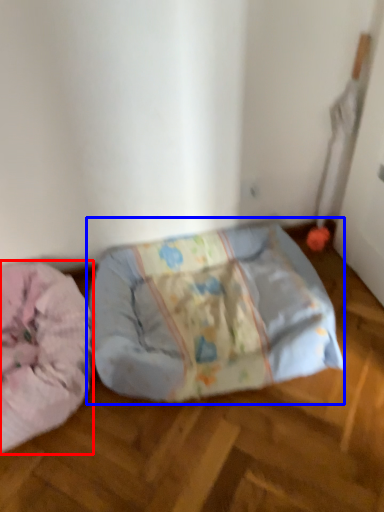
Question: Which object is closer to the camera taking this photo, dog bed (highlighted by a red box) or furniture (highlighted by a blue box)?

Choices:
 (A) dog bed
 (B) furniture

Answer: (A)